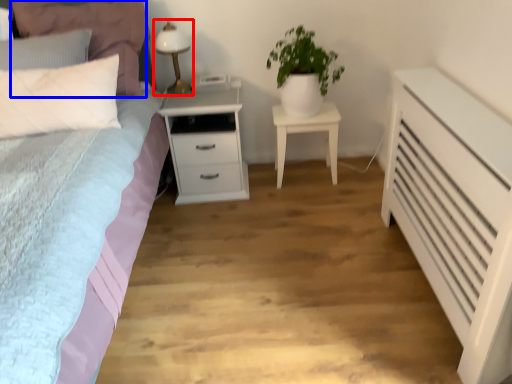
Question: Which object appears closest to the camera in this image, bedside lamp (highlighted by a red box) or pillow (highlighted by a blue box)?

Choices:
 (A) bedside lamp
 (B) pillow

Answer: (B)